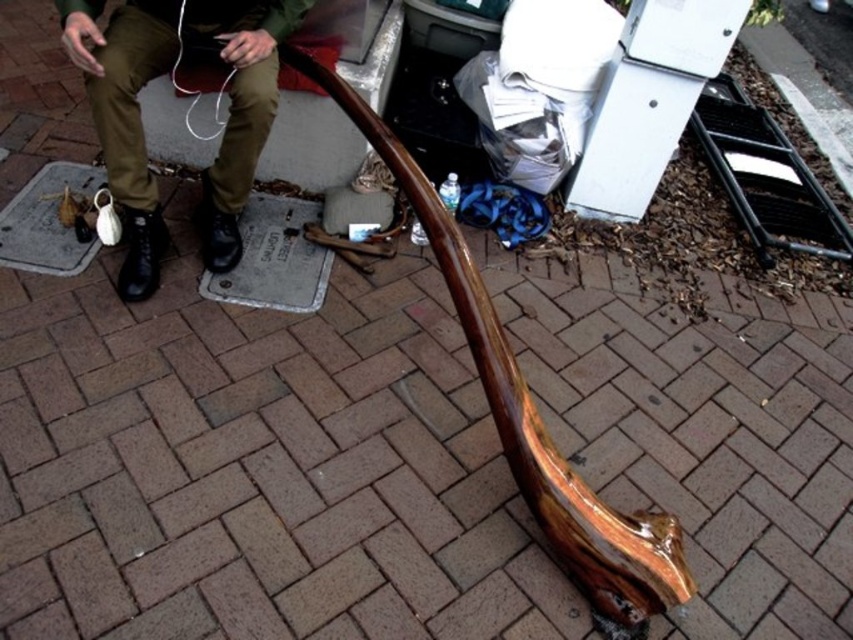
Question: Is glossy wood sculpture at center bigger than matte olive green pants at lower left?

Choices:
 (A) no
 (B) yes

Answer: (B)

Question: Which of the following is the farthest from the observer?

Choices:
 (A) glossy wood sculpture at center
 (B) matte olive green pants at lower left

Answer: (B)

Question: In this image, where is glossy wood sculpture at center located relative to matte olive green pants at lower left?

Choices:
 (A) left
 (B) right

Answer: (B)

Question: Which point is farther to the camera?

Choices:
 (A) (503, 358)
 (B) (68, 38)

Answer: (B)

Question: Is glossy wood sculpture at center to the left of matte olive green pants at lower left from the viewer's perspective?

Choices:
 (A) no
 (B) yes

Answer: (A)